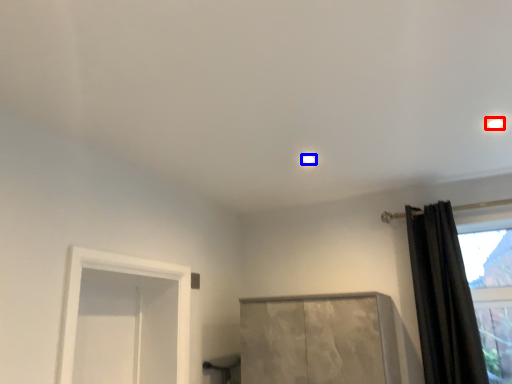
Question: Which object appears farthest to the camera in this image, lighting (highlighted by a red box) or lighting (highlighted by a blue box)?

Choices:
 (A) lighting
 (B) lighting

Answer: (B)